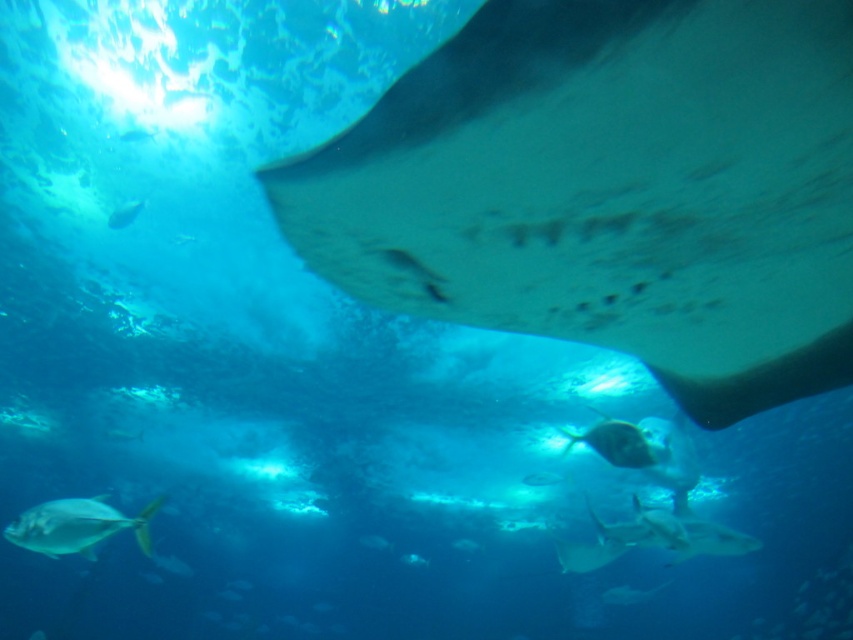
Question: Which point is closer to the camera?

Choices:
 (A) (618, 458)
 (B) (132, 525)
 (C) (120, 214)
 (D) (636, 168)

Answer: (D)

Question: Does shiny silver fish at center have a smaller size compared to shiny silver fish at upper left?

Choices:
 (A) yes
 (B) no

Answer: (B)

Question: Among these objects, which one is nearest to the camera?

Choices:
 (A) smooth gray stingray at upper right
 (B) shiny silver fish at lower left

Answer: (A)

Question: Observing the image, what is the correct spatial positioning of smooth gray stingray at upper right in reference to shiny silver fish at lower left?

Choices:
 (A) below
 (B) above

Answer: (B)

Question: Does smooth gray stingray at upper right come in front of shiny silver fish at upper left?

Choices:
 (A) no
 (B) yes

Answer: (B)

Question: Which point is farther from the camera taking this photo?

Choices:
 (A) (799, 301)
 (B) (35, 515)

Answer: (B)